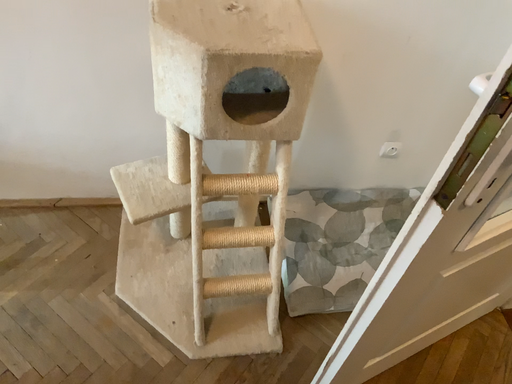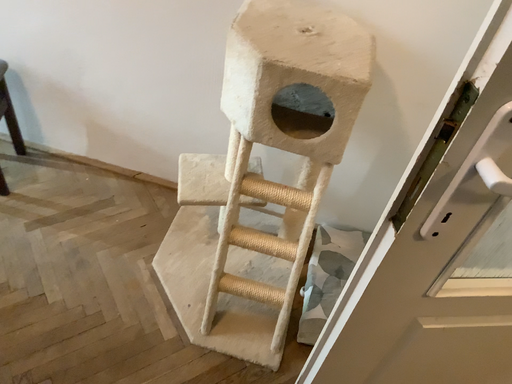
Question: How did the camera likely rotate when shooting the video?

Choices:
 (A) rotated upward
 (B) rotated downward

Answer: (A)